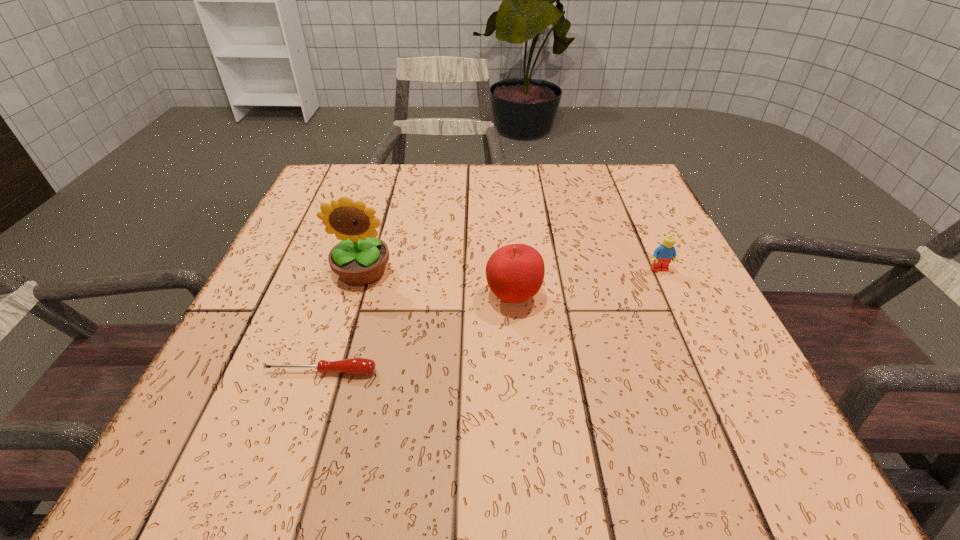
Image resolution: width=960 pixels, height=540 pixels. What are the coordinates of `sunflower` in the screenshot? It's located at (360, 259).

Where is `the third shortest object`? This screenshot has width=960, height=540. the third shortest object is located at coordinates (515, 272).

Locate an element on the screen. the third object from left to right is located at coordinates (515, 272).

Identify the location of Lego. This screenshot has height=540, width=960. (666, 252).

Where is `the rightmost object`? Image resolution: width=960 pixels, height=540 pixels. the rightmost object is located at coordinates (666, 252).

The height and width of the screenshot is (540, 960). Find the location of `the shortest object`. the shortest object is located at coordinates (355, 366).

This screenshot has width=960, height=540. Find the location of `screwdriver`. screwdriver is located at coordinates (355, 366).

Where is `free location located on the face of the sunflower`? Image resolution: width=960 pixels, height=540 pixels. free location located on the face of the sunflower is located at coordinates (348, 321).

Where is `blank area located on the left of the apple`? The width and height of the screenshot is (960, 540). blank area located on the left of the apple is located at coordinates (368, 297).

At what (x,y) coordinates should I click in order to perform the action: click on free location located on the face of the rightmost object. Please return your answer as a coordinate pair (x, y). The image size is (960, 540). Looking at the image, I should click on (717, 394).